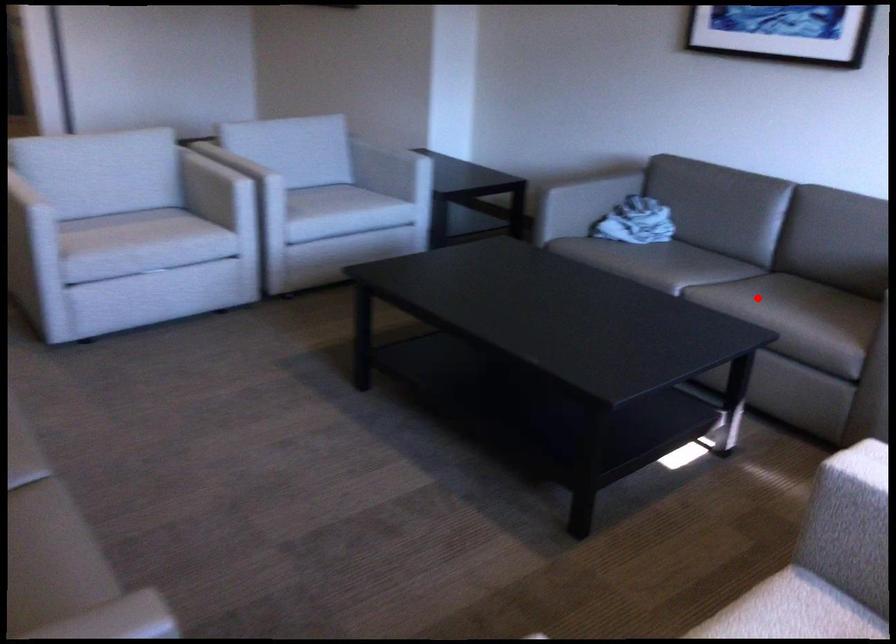
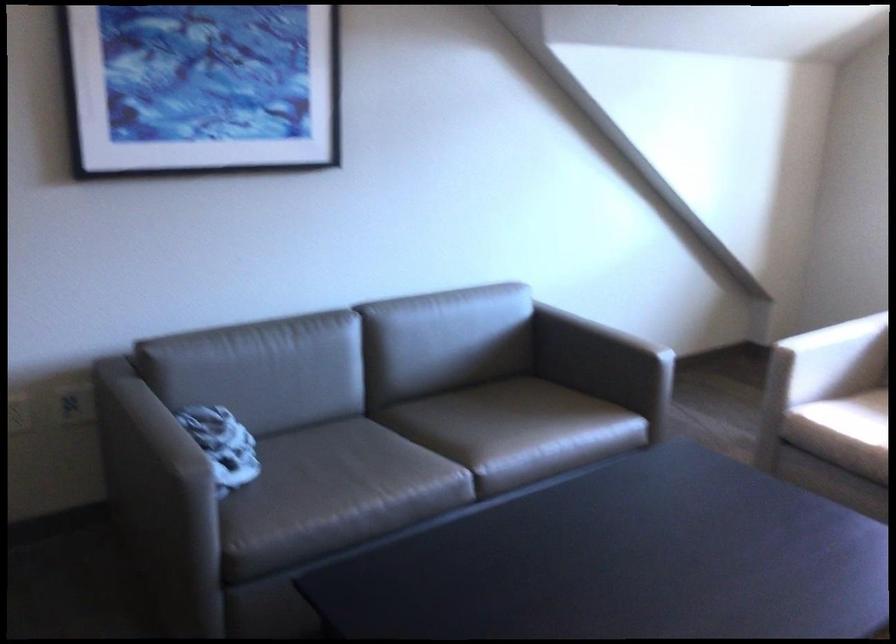
Question: A red point is marked in image1. In image2, is the corresponding 3D point closer to the camera or farther? Reply with the corresponding letter.

Choices:
 (A) The corresponding 3D point is closer.
 (B) The corresponding 3D point is farther.

Answer: (A)